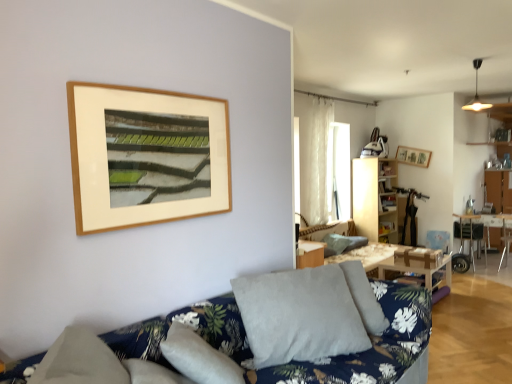
Question: From the image's perspective, relative to metallic silver chair at right, is textured gray pillow at center, which appears as the 2th pillow when viewed from the left, above or below?

Choices:
 (A) below
 (B) above

Answer: (B)

Question: Considering the relative positions of textured gray pillow at center, which appears as the second pillow when viewed from the front, and metallic silver chair at right in the image provided, is textured gray pillow at center, which appears as the second pillow when viewed from the front, to the left or to the right of metallic silver chair at right?

Choices:
 (A) right
 (B) left

Answer: (B)

Question: Which object is the closest to the metallic silver chair at right?

Choices:
 (A) wooden table at center, the 2th table in the right-to-left sequence
 (B) wooden table at right, the 2th table viewed from the front
 (C) wooden picture frame at upper right
 (D) gray fabric pillow at center, the second pillow viewed from the back
 (E) textured gray pillow at center, the 1th pillow when ordered from back to front

Answer: (B)

Question: Based on their relative distances, which object is farther from the metallic silver chair at right?

Choices:
 (A) wooden picture frame at upper right
 (B) wooden table at center, the 2th table in the right-to-left sequence
 (C) gray fabric pillow at center, the first pillow viewed from the left
 (D) white sheer curtain at upper center
 (E) wooden table at right, arranged as the first table when viewed from the right

Answer: (C)